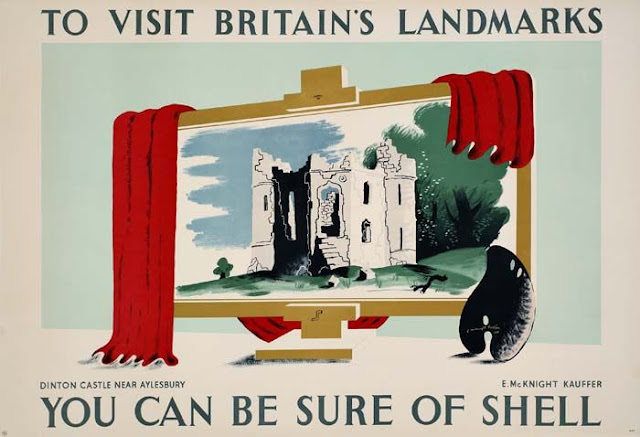
Identify the location of window. (258, 197), (368, 197), (368, 228), (399, 191), (410, 237).